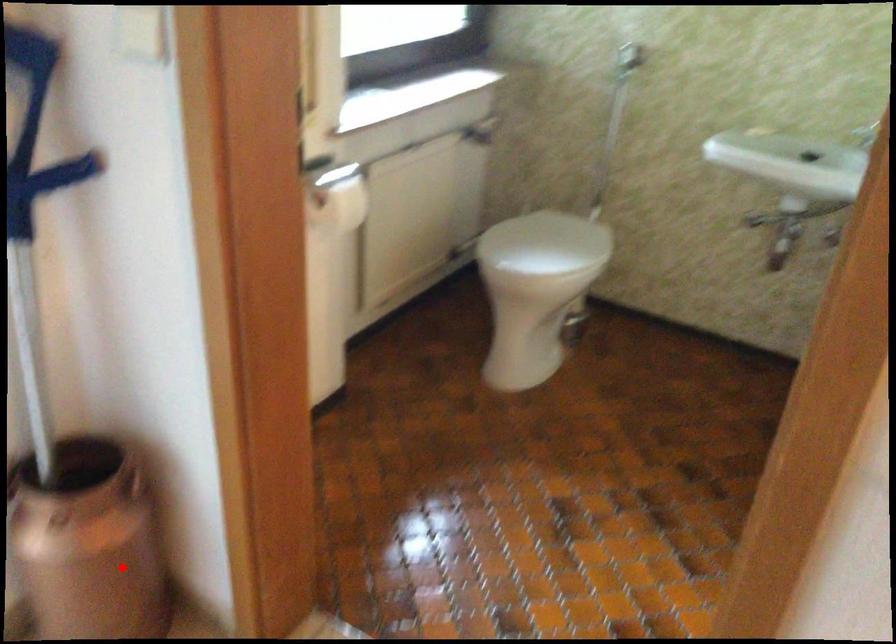
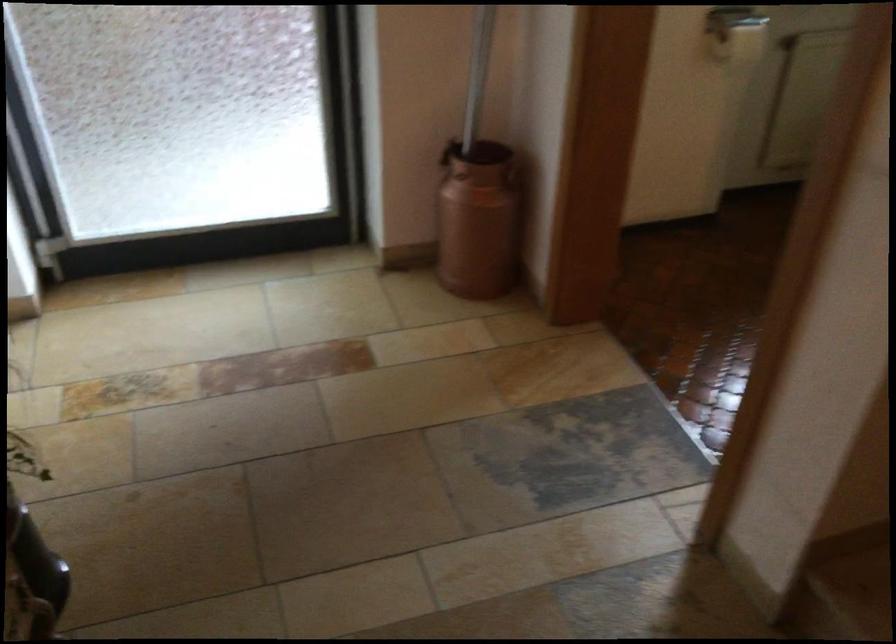
The point at the highlighted location is marked in the first image. Where is the corresponding point in the second image?

(478, 220)